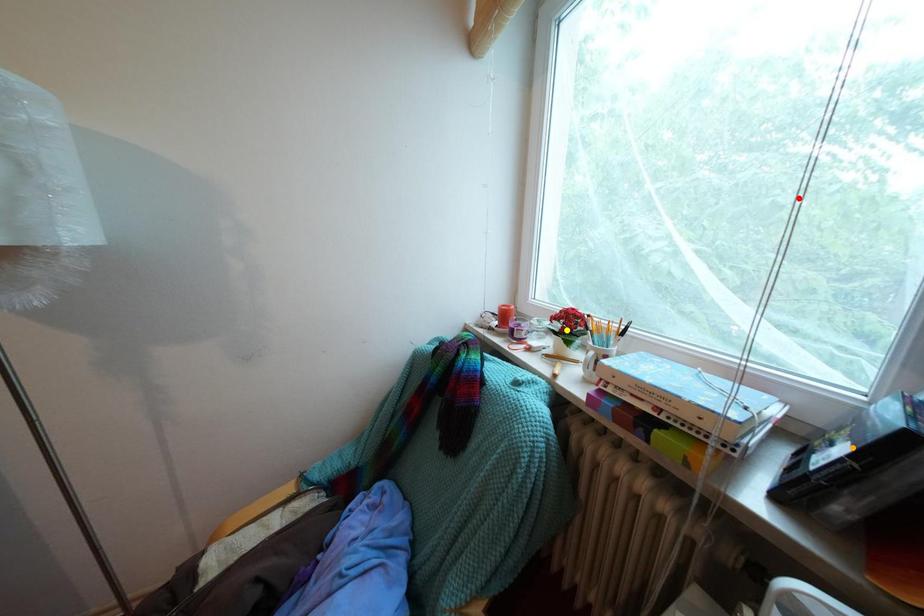
Order these from nearest to farthest:
orange point
yellow point
red point

orange point < yellow point < red point